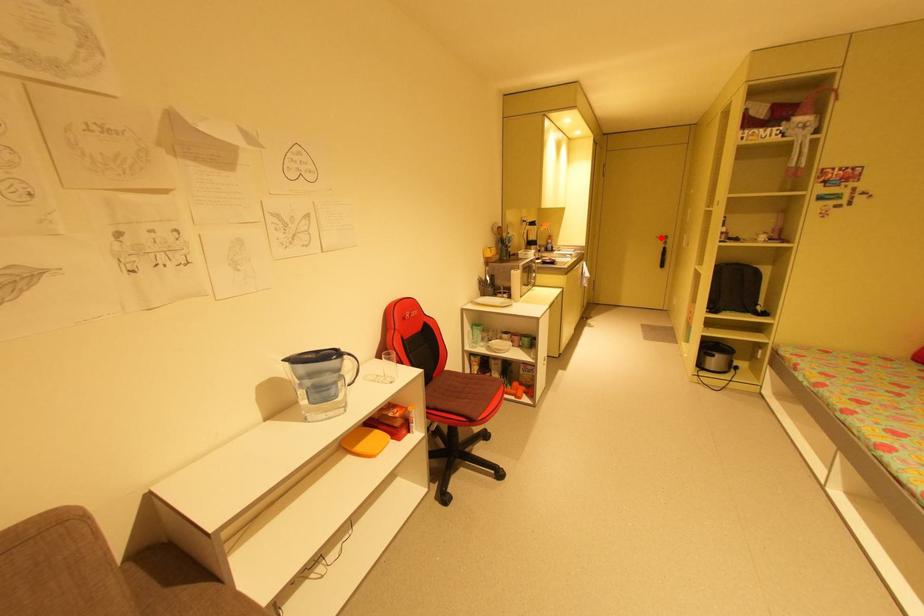
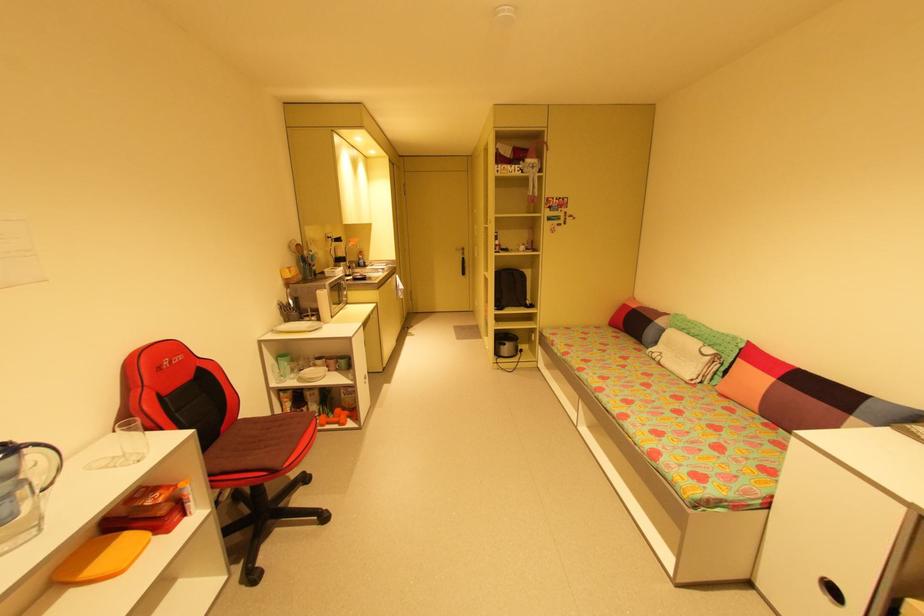
Question: I am providing you with two images of the same scene from different viewpoints. Image1 has a red point marked. In image2, the corresponding 3D location appears at what relative position? Reply with the corresponding letter.

Choices:
 (A) Closer
 (B) Farther

Answer: (A)